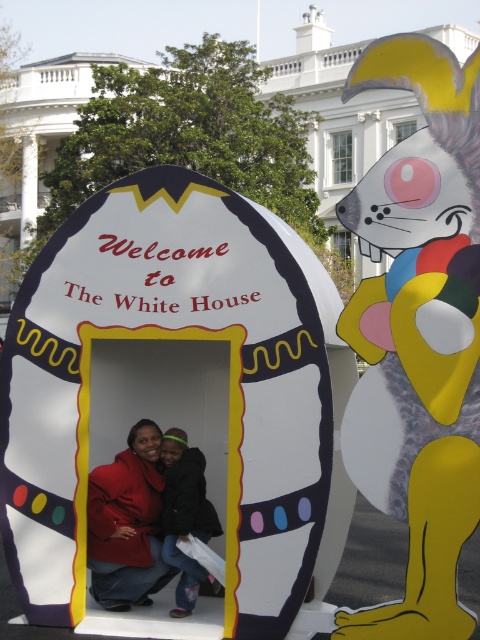
Question: Does matte yellow and gray cat at right appear over matte red coat at center?

Choices:
 (A) yes
 (B) no

Answer: (A)

Question: Considering the real-world distances, which object is closest to the matte red coat at center?

Choices:
 (A) denim pants at center
 (B) matte yellow and gray cat at right

Answer: (A)

Question: Is matte yellow and gray cat at right smaller than denim pants at center?

Choices:
 (A) yes
 (B) no

Answer: (B)

Question: Among these points, which one is nearest to the camera?

Choices:
 (A) [x=165, y=468]
 (B) [x=418, y=96]

Answer: (B)

Question: Which object is closer to the camera taking this photo?

Choices:
 (A) matte yellow and gray cat at right
 (B) matte red coat at center
 (C) denim pants at center

Answer: (A)

Question: Can you confirm if matte red coat at center is bigger than denim pants at center?

Choices:
 (A) no
 (B) yes

Answer: (B)